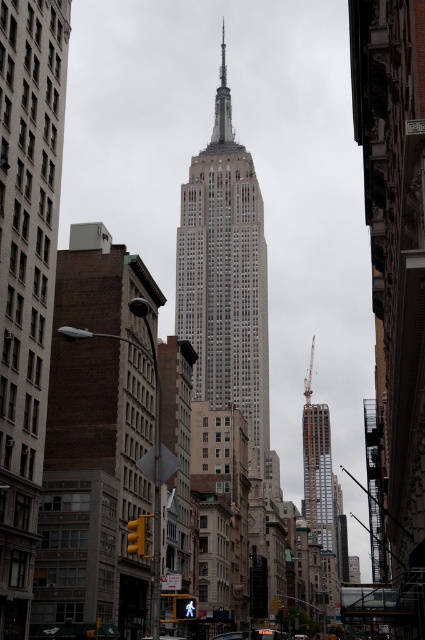
This screenshot has height=640, width=425. What do you see at coordinates (223, 104) in the screenshot?
I see `silver metallic spire at center` at bounding box center [223, 104].

Who is shorter, silver metallic spire at center or metallic silver car at center?

With less height is metallic silver car at center.

Is point (229, 106) more distant than point (265, 628)?

Yes, point (229, 106) is behind point (265, 628).

Identify the location of silver metallic spire at center. (223, 104).

Does white glass building at center appear on the left side of silver metallic spire at center?

Indeed, white glass building at center is positioned on the left side of silver metallic spire at center.

Is point (210, 289) closer to camera compared to point (215, 109)?

Yes, it is in front of point (215, 109).

Find the location of `white glass building at center`. white glass building at center is located at coordinates (226, 280).

From the picture: Is silver metallic spire at center thinner than metallic silver spire at center?

Incorrect, silver metallic spire at center's width is not less than metallic silver spire at center's.

Which is more to the left, silver metallic spire at center or metallic silver spire at center?

Positioned to the left is silver metallic spire at center.

Who is more forward, (223, 29) or (309, 396)?

Point (223, 29) is in front.

You are a GUI agent. You are given a task and a screenshot of the screen. Output one action in this format:
    pyautogui.click(x=<x>, y=<y>)
    Task: Click on the silver metallic spire at center
    
    Given the screenshot: What is the action you would take?
    pyautogui.click(x=223, y=104)